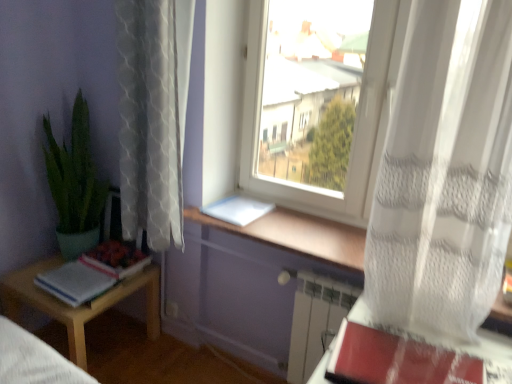
Identify the location of free space above red matte paperback book at lower right, which is the second paperback book in back-to-front order (from a real-world perspective). This screenshot has width=512, height=384. (378, 346).